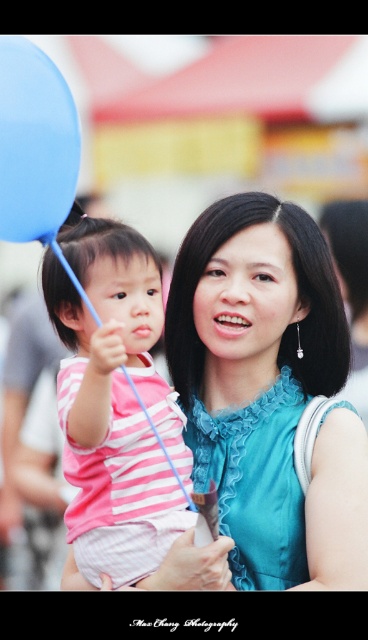
You are a photographer trying to capture the blue satin dress at center and the pink striped shirt at left in a single frame. Which clothing item should you focus on first to ensure both are in the frame?

The blue satin dress at center is positioned over the pink striped shirt at left, so you should focus on the blue satin dress at center first to ensure both are in the frame.

In the scene described, there is a blue satin dress at center and a pink striped shirt at left. If someone is looking at the image from the left side, which clothing item would they see first?

The pink striped shirt at left would be seen first as it is positioned to the left of the blue satin dress at center.

You are a photographer trying to capture the blue satin dress at center and the blue rubber balloon at upper left in a single frame. Based on their sizes, which object would appear larger in the photo?

The blue satin dress at center would appear larger in the photo because its width surpasses that of the blue rubber balloon at upper left.